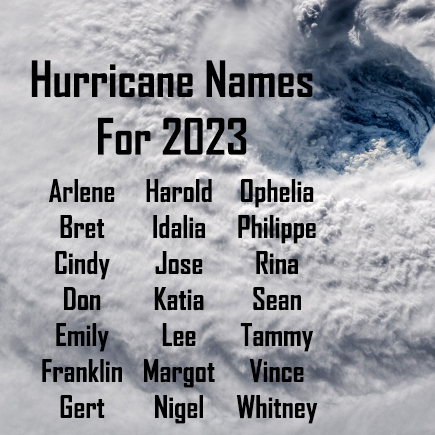
Locate an element on the screen. The image size is (435, 435). poster is located at coordinates (334, 291).